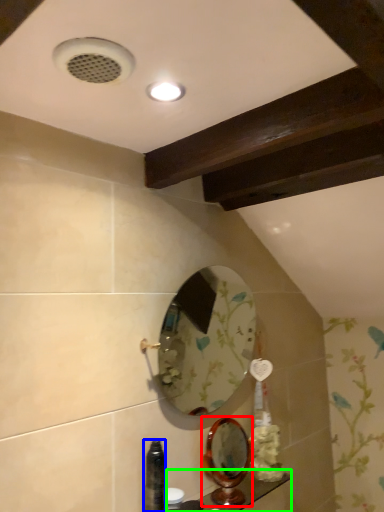
Question: Which object is the closest to the mirror (highlighted by a red box)? Choose among these: bottle (highlighted by a blue box) or counter top (highlighted by a green box).

Choices:
 (A) bottle
 (B) counter top

Answer: (B)